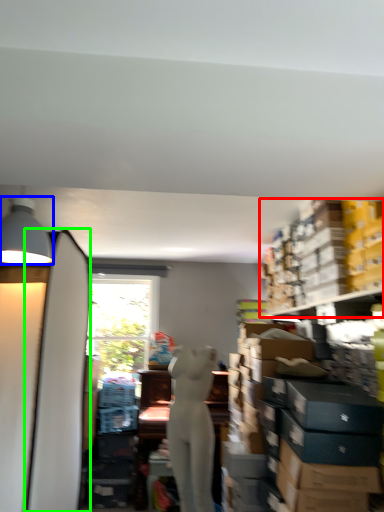
Question: Which object is the closest to the shelf (highlighted by a red box)? Choose among these: lamp (highlighted by a blue box) or surfboard (highlighted by a green box).

Choices:
 (A) lamp
 (B) surfboard

Answer: (B)